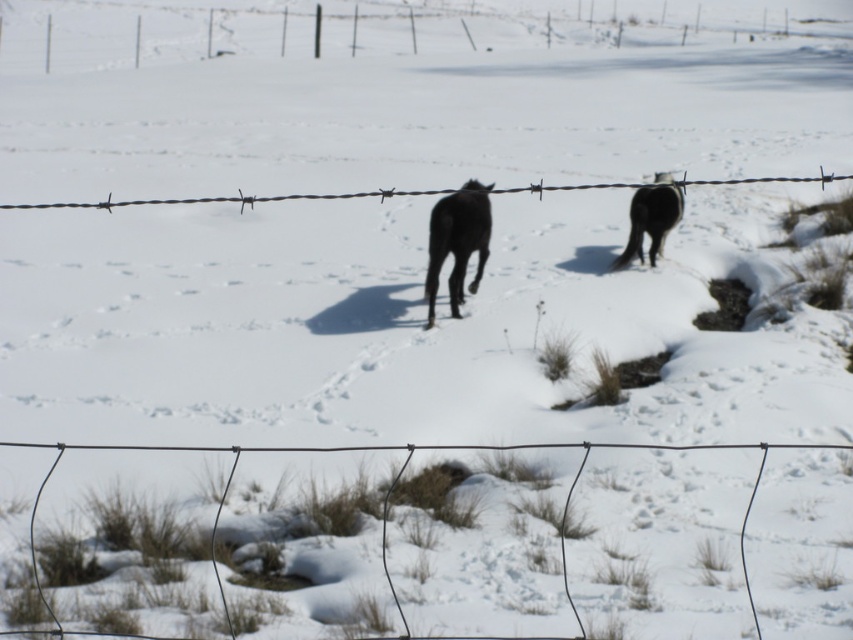
You are a farmer checking the fence on a snowy day. You notice the barbed wire at upper center and the black glossy horse at right. Which object appears larger in the image?

The barbed wire at upper center appears larger than the black glossy horse at right in the image.

You are a farmer checking the fence in the snowy field. You notice the wire mesh at center and the black glossy horse at right. Which object is smaller in size?

The wire mesh at center has a smaller size compared to the black glossy horse at right, so the wire mesh at center is smaller.

You are a photographer trying to capture a clear shot of the black glossy horse at right without the barbed wire at upper center appearing in the foreground. Can you adjust your camera angle to achieve this?

The barbed wire at upper center is above the black glossy horse at right, so you can lower your camera angle to aim below the barbed wire and capture the horse without the wire obstructing the view.